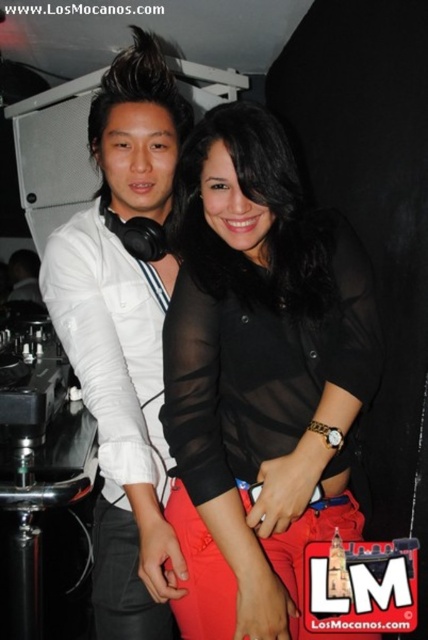
Question: Which of the following is the farthest from the observer?

Choices:
 (A) sheer black blouse at center
 (B) white matte shirt at left

Answer: (B)

Question: Can you confirm if sheer black blouse at center is wider than white matte shirt at left?

Choices:
 (A) no
 (B) yes

Answer: (B)

Question: Which point is farther from the camera taking this photo?

Choices:
 (A) (131, 141)
 (B) (335, 294)

Answer: (A)

Question: Is sheer black blouse at center to the left of white matte shirt at left from the viewer's perspective?

Choices:
 (A) yes
 (B) no

Answer: (B)

Question: Does sheer black blouse at center appear on the right side of white matte shirt at left?

Choices:
 (A) no
 (B) yes

Answer: (B)